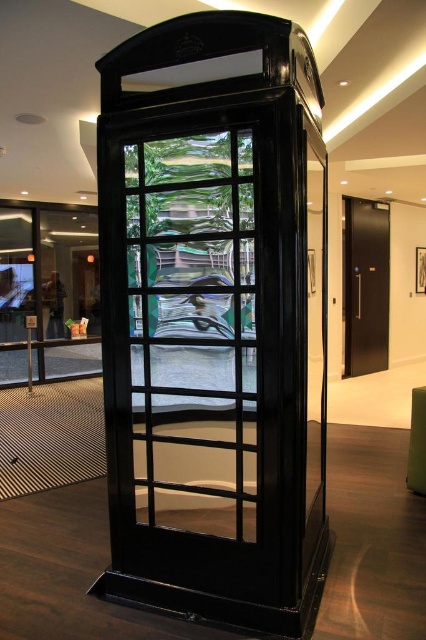
Is clear glass door at center taller than black metal elevator at right?

In fact, clear glass door at center may be shorter than black metal elevator at right.

Is point (210, 428) behind point (342, 227)?

No, (210, 428) is closer to viewer.

Locate an element on the screen. Image resolution: width=426 pixels, height=640 pixels. clear glass door at center is located at coordinates (192, 332).